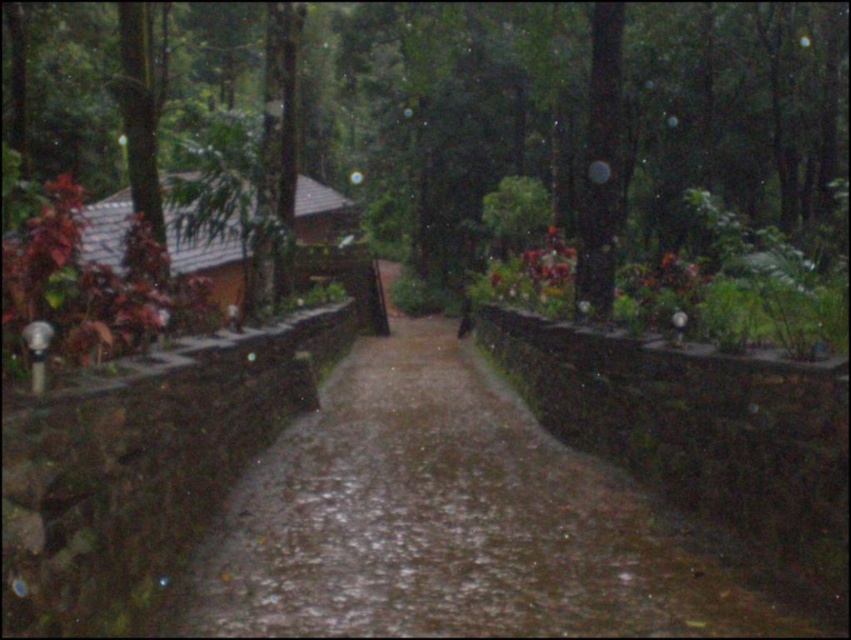
You are standing at the edge of the forest and want to walk towards the damp concrete path at center. However, there is a green matte tree at center in your way. Which object should you move around to reach the path?

You should move around the green matte tree at center because the damp concrete path at center is closer to you, so the tree is between you and the path.